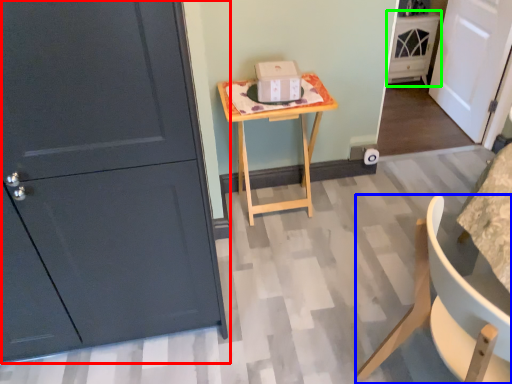
Question: Estimate the real-world distances between objects in this image. Which object is farther from door (highlighted by a red box), chair (highlighted by a blue box) or cabinetry (highlighted by a green box)?

Choices:
 (A) chair
 (B) cabinetry

Answer: (B)